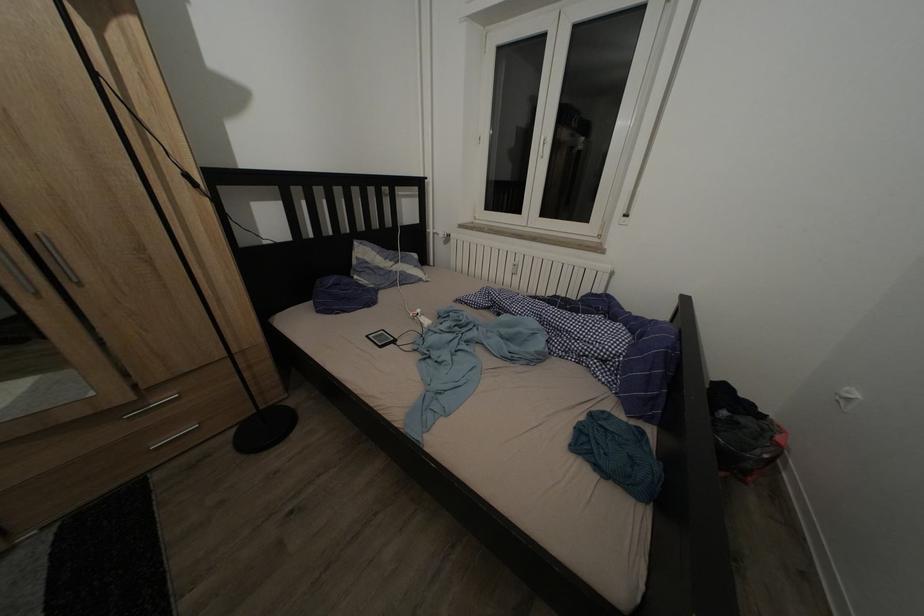
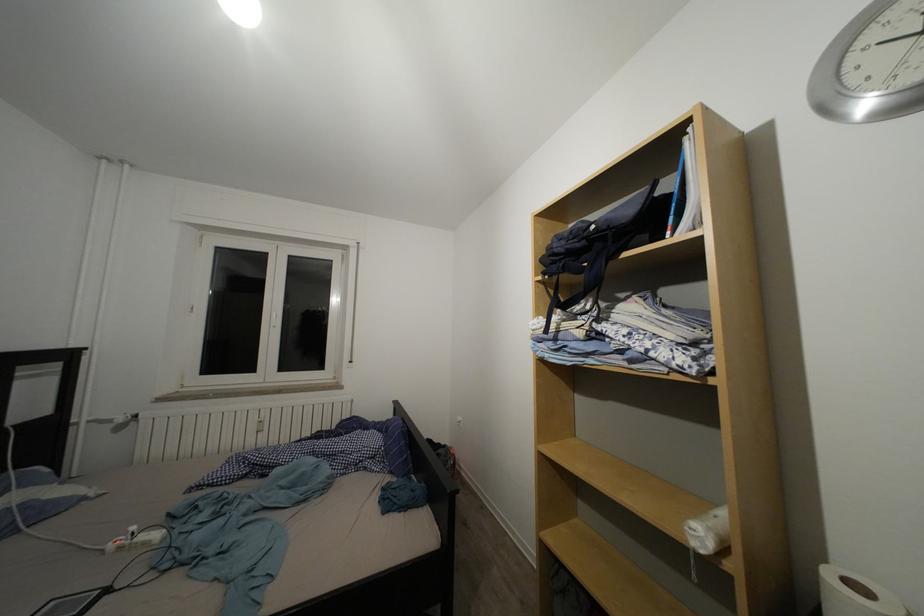
In the second image, find the point that corresponds to point 427,317 in the first image.

(140, 533)